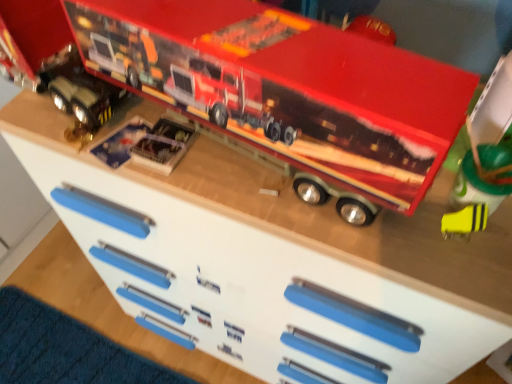
The image size is (512, 384). I want to click on vacant space that is in between clear plastic toy at center, which is counted as the third toy, starting from the right, and yellow matte eraser at lower right, placed as the first toy when sorted from right to left, so click(x=287, y=191).